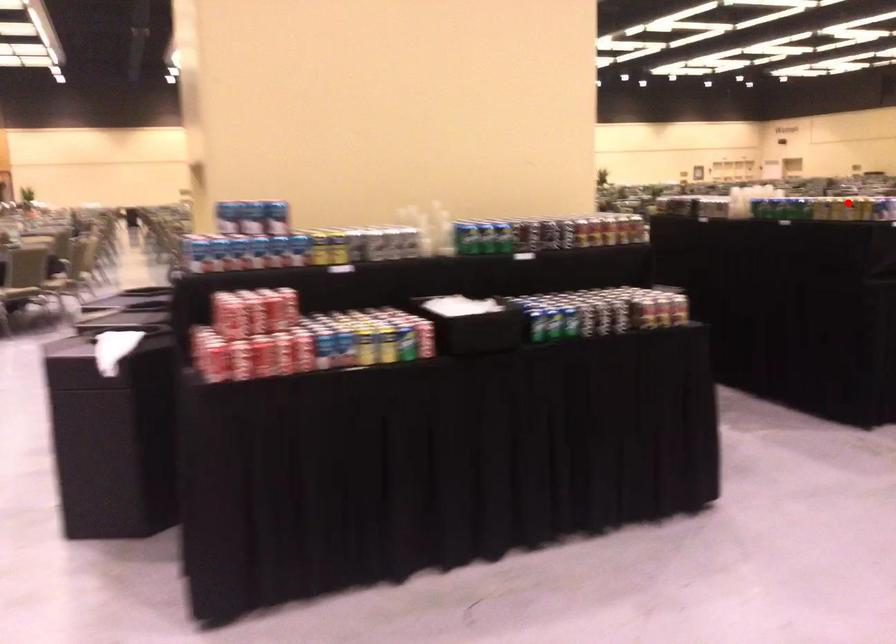
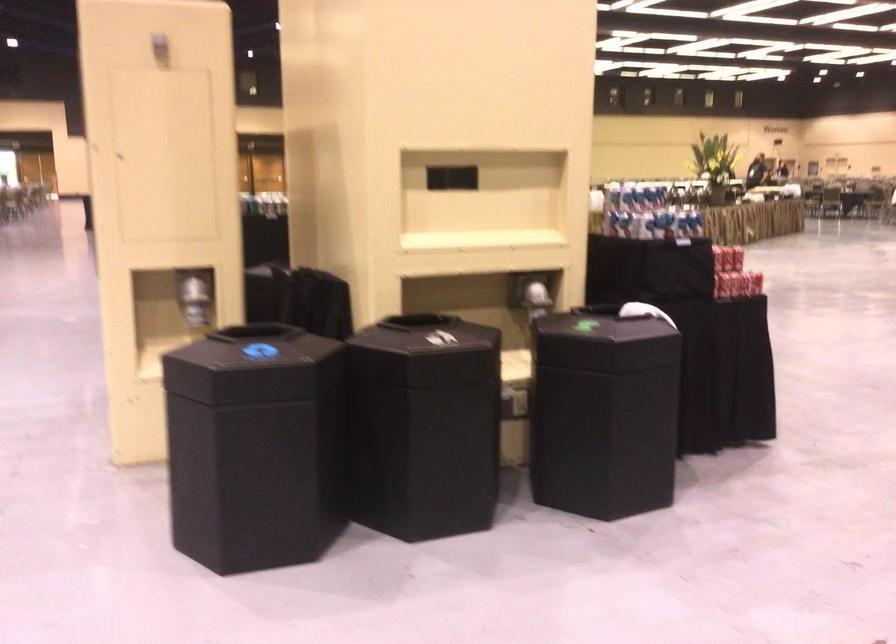
Question: I am providing you with two images of the same scene from different viewpoints. A red point is marked on the first image. Can you still see the location of the red point in image 2?

Choices:
 (A) Yes
 (B) No

Answer: (B)